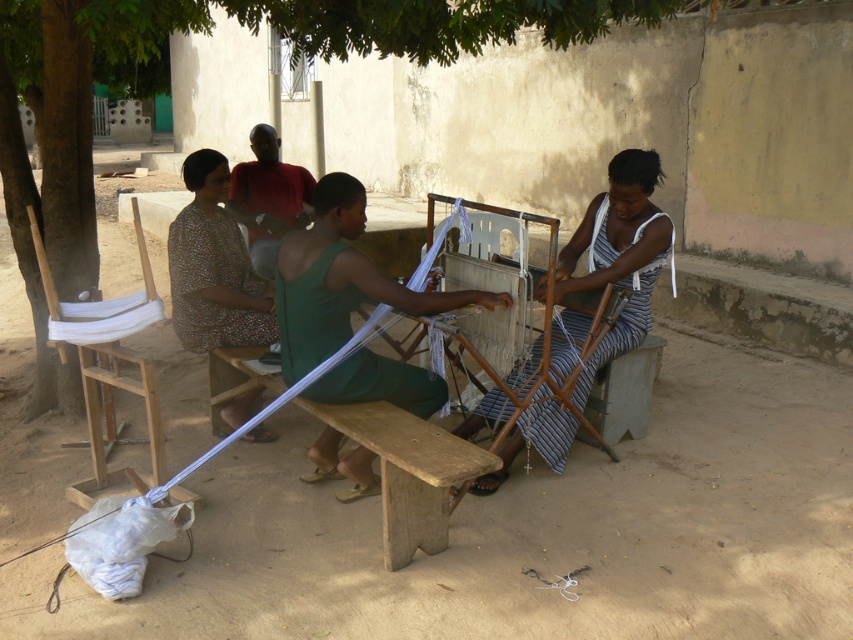
Question: Is striped fabric at center to the left of printed fabric dress at center from the viewer's perspective?

Choices:
 (A) yes
 (B) no

Answer: (B)

Question: Which point appears closest to the camera in this image?

Choices:
 (A) (668, 227)
 (B) (469, 44)
 (C) (262, 428)

Answer: (A)

Question: Which is farther from the green leafy tree at upper left?

Choices:
 (A) printed fabric dress at center
 (B) green fabric at center
 (C) striped fabric at center

Answer: (B)

Question: Which point is closer to the camera?

Choices:
 (A) (350, 291)
 (B) (485, 397)

Answer: (A)

Question: Is striped fabric at center positioned in front of printed fabric dress at center?

Choices:
 (A) no
 (B) yes

Answer: (B)

Question: Does green fabric at center have a lesser width compared to printed fabric dress at center?

Choices:
 (A) yes
 (B) no

Answer: (B)